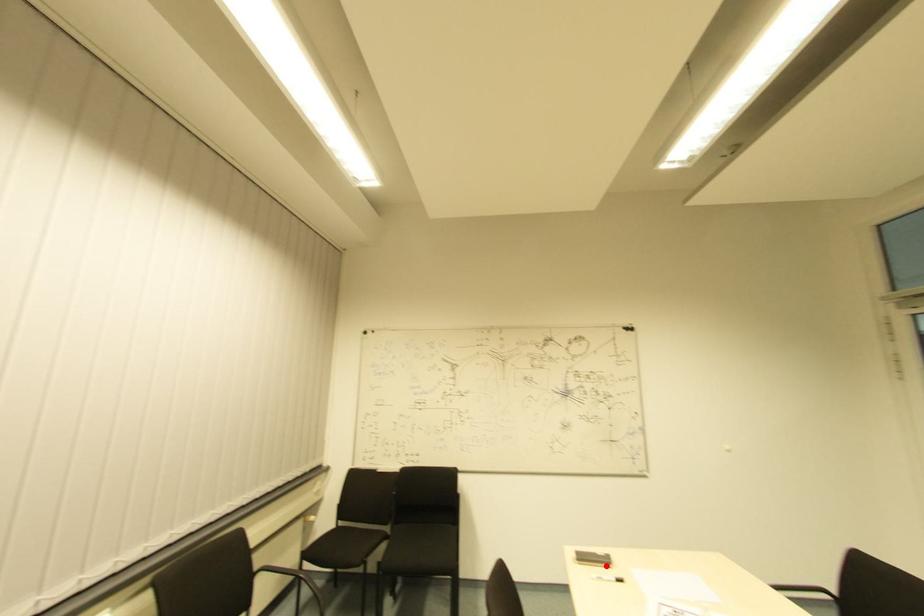
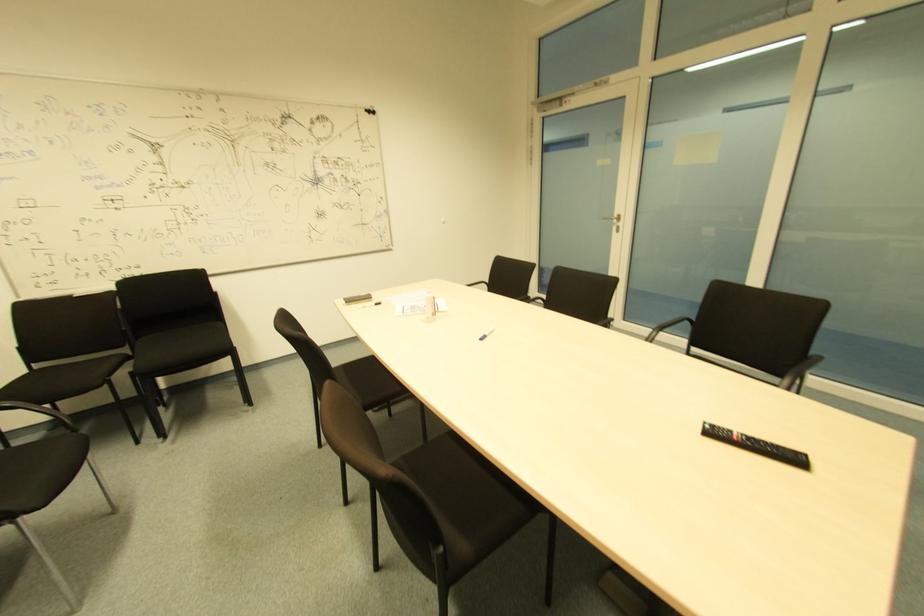
The point at the highlighted location is marked in the first image. Where is the corresponding point in the second image?

(365, 301)